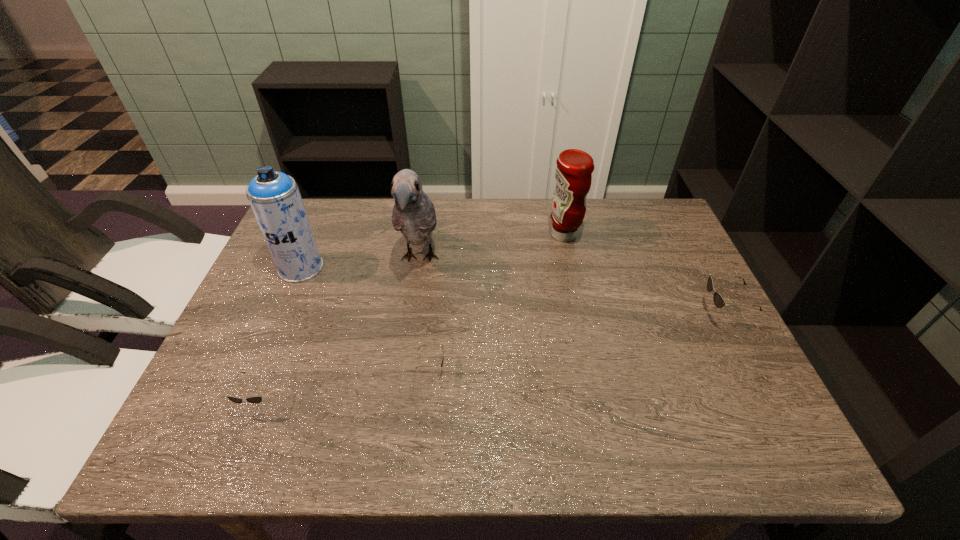
The height and width of the screenshot is (540, 960). I want to click on object that is the second nearest to the aerosol can, so click(x=253, y=399).

Locate which object ranks in proximity to the second shortest sunglasses. Please provide its 2D coordinates. Your answer should be formatted as a tuple, i.e. [(x, y)], where the tuple contains the x and y coordinates of a point satisfying the conditions above.

[(441, 364)]

Find the location of `sunglasses that is the second closest to the shortest sunglasses`. sunglasses that is the second closest to the shortest sunglasses is located at coordinates (719, 301).

Locate which sunglasses ranks in proximity to the condiment. Please provide its 2D coordinates. Your answer should be formatted as a tuple, i.e. [(x, y)], where the tuple contains the x and y coordinates of a point satisfying the conditions above.

[(719, 301)]

The image size is (960, 540). I want to click on vacant point that satisfies the following two spatial constraints: 1. on the back side of the condiment; 2. on the left side of the aerosol can, so click(x=315, y=235).

At what (x,y) coordinates should I click in order to perform the action: click on free space in the image that satisfies the following two spatial constraints: 1. in front of the lenses of the shortest sunglasses; 2. in front of the lenses of the second shortest object. Please return your answer as a coordinate pair (x, y). Looking at the image, I should click on (429, 401).

Where is `vacant region that satisfies the following two spatial constraints: 1. in front of the lenses of the shortest sunglasses; 2. in front of the lenses of the second shortest object`? vacant region that satisfies the following two spatial constraints: 1. in front of the lenses of the shortest sunglasses; 2. in front of the lenses of the second shortest object is located at coordinates (429, 401).

I want to click on vacant area that satisfies the following two spatial constraints: 1. on the front side of the condiment; 2. in front of the lenses of the second sunglasses from left to right, so click(593, 369).